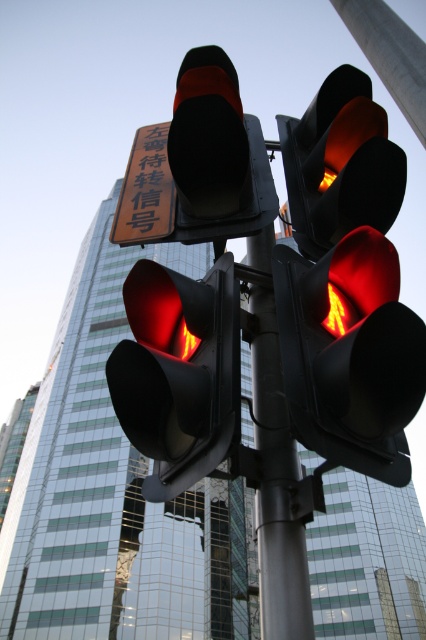
Question: Where is matte black traffic light at left located in relation to metallic pole at center in the image?

Choices:
 (A) left
 (B) right

Answer: (A)

Question: Among these points, which one is nearest to the camera?

Choices:
 (A) coord(262,573)
 (B) coord(218,275)
 (C) coord(131,202)

Answer: (A)

Question: Is matte black traffic light at center further to the viewer compared to matte black traffic light at left?

Choices:
 (A) no
 (B) yes

Answer: (A)

Question: Does metallic pole at center appear under orange reflective sign at upper center?

Choices:
 (A) no
 (B) yes

Answer: (B)

Question: Among these objects, which one is farthest from the camera?

Choices:
 (A) matte black traffic light at left
 (B) orange reflective sign at upper center
 (C) metallic pole at center

Answer: (B)

Question: Based on their relative distances, which object is farther from the matte black traffic light at center?

Choices:
 (A) metallic pole at center
 (B) orange reflective sign at upper center

Answer: (B)